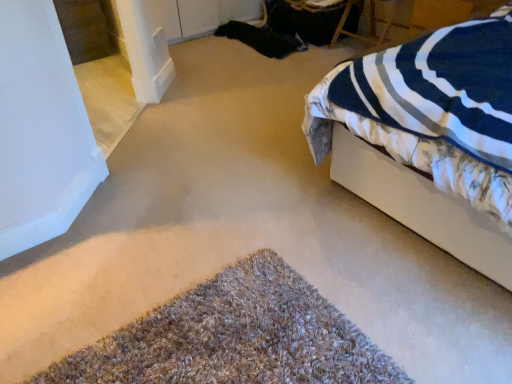
Find the location of a particular element. vacant space underneath brown shaggy carpet at lower center (from a real-world perspective) is located at coordinates (243, 336).